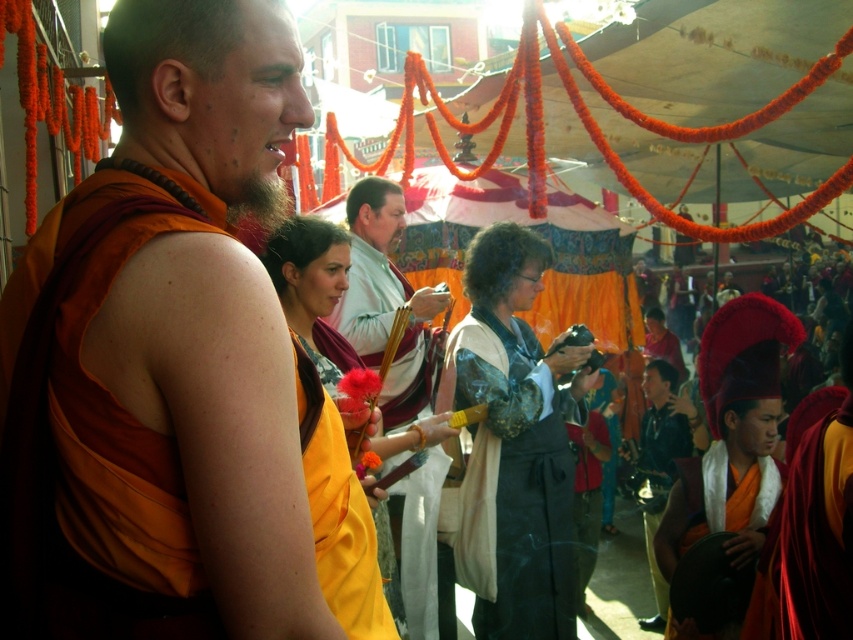
You are standing at the entrance of the tent and see the point marked at coordinates (177, 365). What object is located at that point?

The point at coordinates (177, 365) marks the matte orange robe at center.